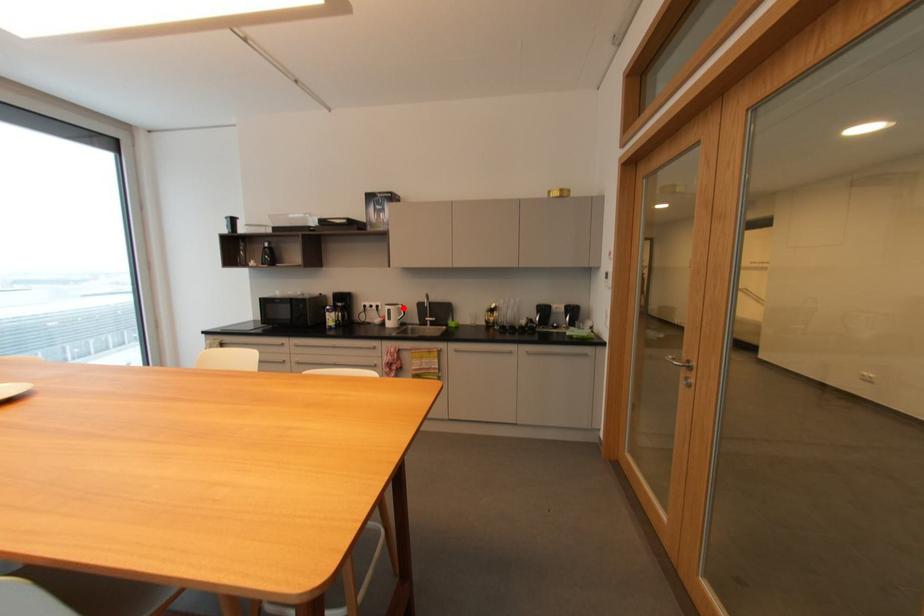
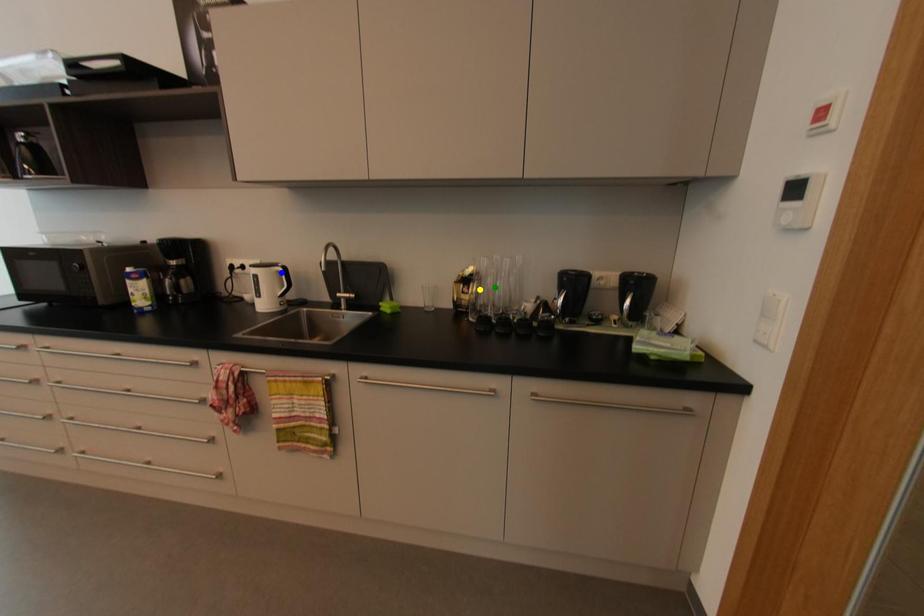
Question: I am providing you with two images of the same scene from different viewpoints. A red point is marked on the first image. You are given multiple points on the second image. Which point in image 2 is actually the same real-world point as the red point in image 1?

Choices:
 (A) yellow point
 (B) blue point
 (C) green point

Answer: (B)